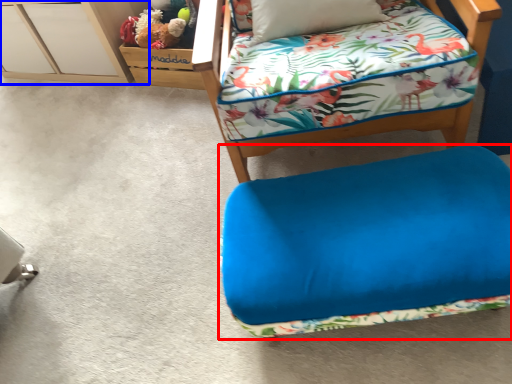
Question: Among these objects, which one is farthest to the camera, furniture (highlighted by a red box) or file cabinet (highlighted by a blue box)?

Choices:
 (A) furniture
 (B) file cabinet

Answer: (B)